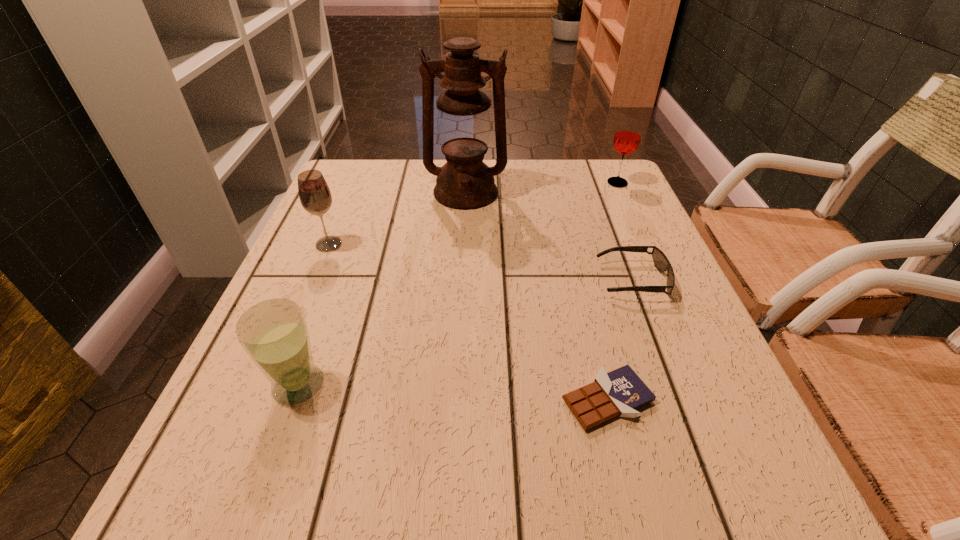
The image size is (960, 540). What are the coordinates of `the third object from left to right` in the screenshot? It's located at (465, 182).

This screenshot has width=960, height=540. I want to click on the tallest object, so click(x=465, y=182).

Find the location of `the third farthest object`. the third farthest object is located at coordinates (314, 194).

Image resolution: width=960 pixels, height=540 pixels. In order to click on the farthest glass in this screenshot , I will do `click(627, 137)`.

What are the coordinates of `the nearest glass` in the screenshot? It's located at (274, 333).

You are a GUI agent. You are given a task and a screenshot of the screen. Output one action in this format:
    pyautogui.click(x=<x>, y=<y>)
    Task: Click on the third nearest object
    
    Given the screenshot: What is the action you would take?
    pyautogui.click(x=661, y=262)

What are the coordinates of `sunglasses` in the screenshot? It's located at (661, 262).

Image resolution: width=960 pixels, height=540 pixels. I want to click on the shortest object, so click(620, 392).

What are the coordinates of `free space located 0.070m on the right of the fourth object from right to left` in the screenshot? It's located at (533, 192).

Identify the location of vacant point located 0.100m on the front of the third farthest object. The height and width of the screenshot is (540, 960). (313, 284).